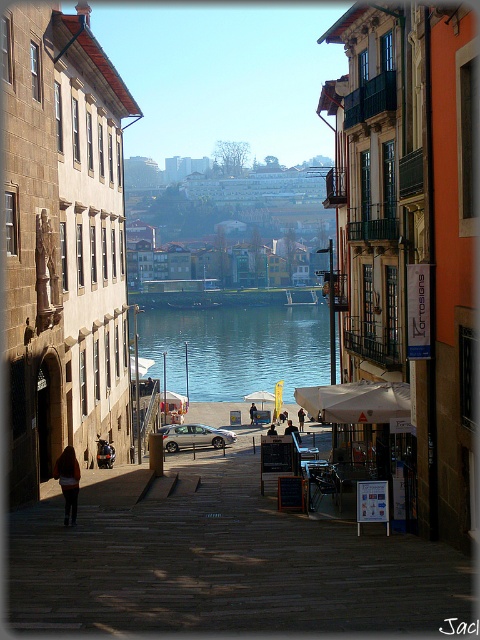
Question: Which is nearer to the dark brown leather jacket at center?

Choices:
 (A) dark brown leather jacket at lower left
 (B) brown leather jacket at lower left
 (C) silver metallic car at center
 (D) matte black jacket at center

Answer: (D)

Question: Is silver metallic car at center below dark blue jeans at center?

Choices:
 (A) yes
 (B) no

Answer: (A)

Question: In this image, where is brown leather jacket at lower left located relative to dark brown leather jacket at center?

Choices:
 (A) below
 (B) above

Answer: (B)

Question: Is silver metallic car at center smaller than dark brown leather jacket at center?

Choices:
 (A) no
 (B) yes

Answer: (A)

Question: Estimate the real-world distances between objects in this image. Which object is closer to the blue glassy water at center?

Choices:
 (A) silver metallic car at center
 (B) dark brown leather jacket at center
 (C) dark blue jeans at center
 (D) dark brown leather jacket at lower left

Answer: (A)

Question: Which point is farther to the camera?

Choices:
 (A) (204, 310)
 (B) (271, 429)

Answer: (A)